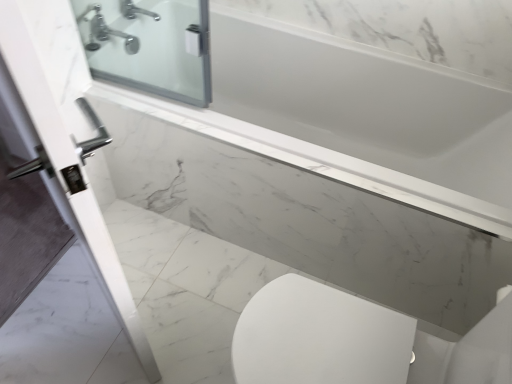
Where is `free point to the right of white glossy door handle at left`? Image resolution: width=512 pixels, height=384 pixels. free point to the right of white glossy door handle at left is located at coordinates (193, 302).